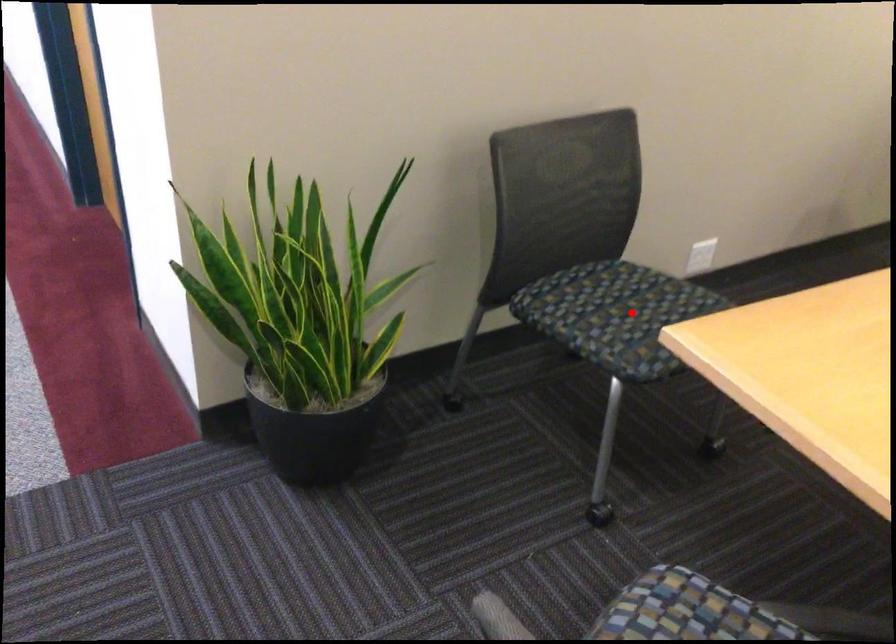
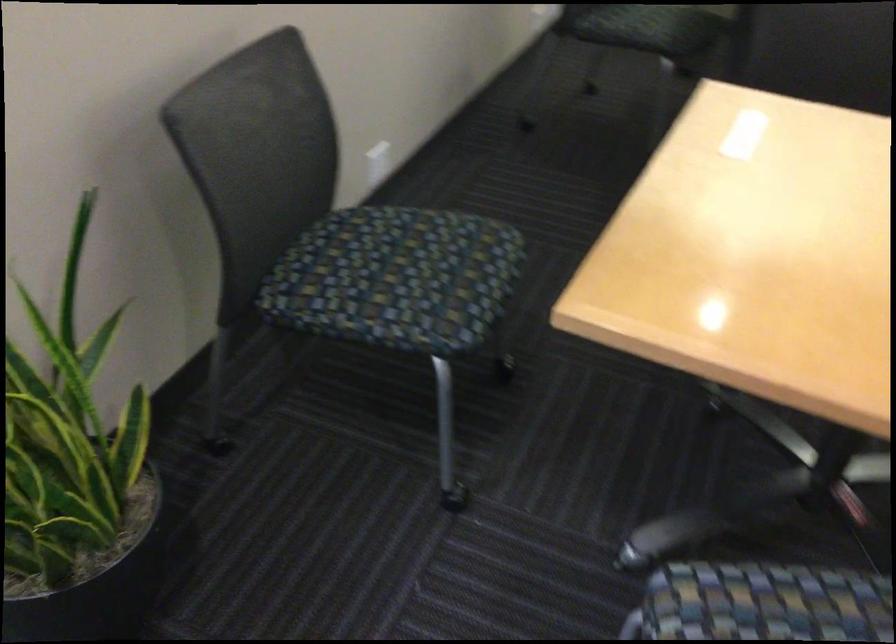
Locate, in the second image, the point that corresponds to the highlighted location in the first image.

(395, 278)